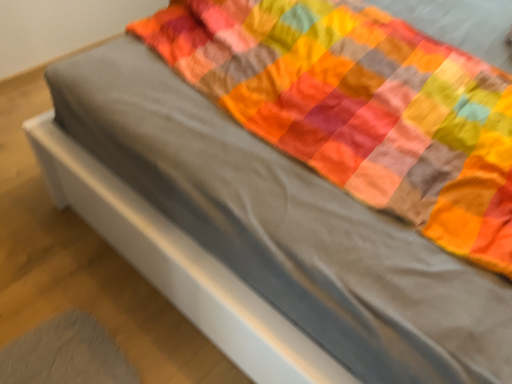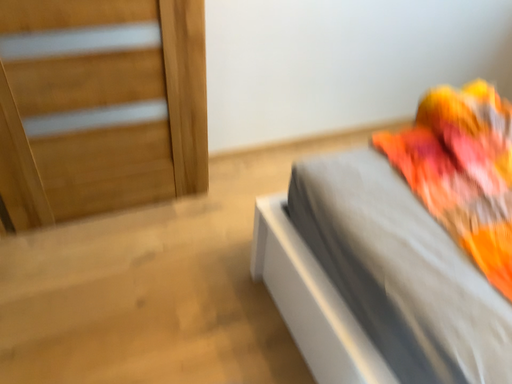
Question: Which way did the camera rotate in the video?

Choices:
 (A) rotated upward
 (B) rotated downward

Answer: (A)